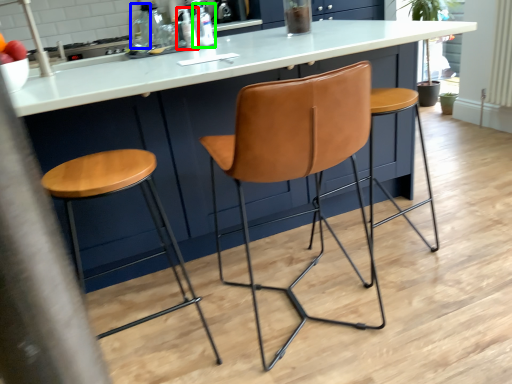
Question: Estimate the real-world distances between objects in this image. Which object is farther from bottle (highlighted by a red box), bottle (highlighted by a blue box) or bottle (highlighted by a green box)?

Choices:
 (A) bottle
 (B) bottle

Answer: (A)